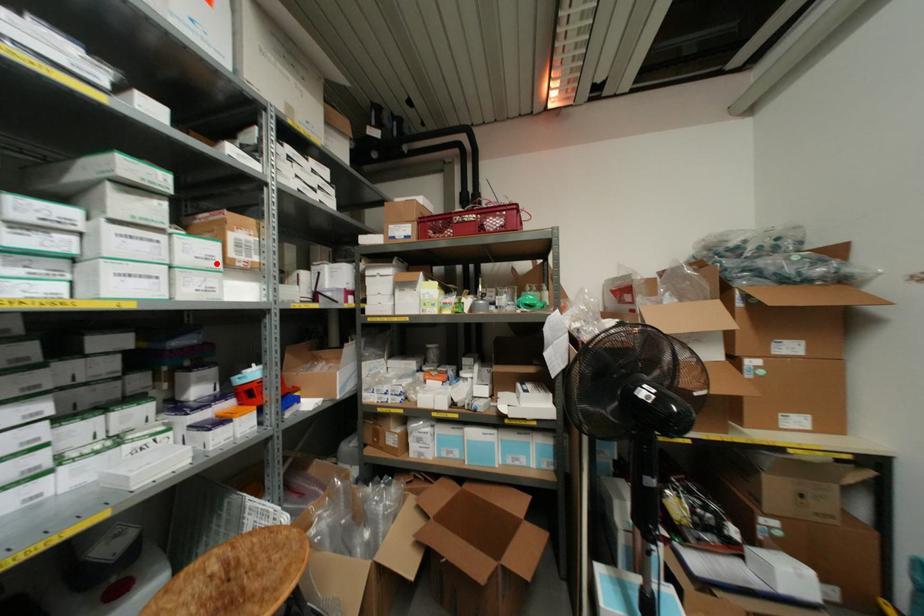
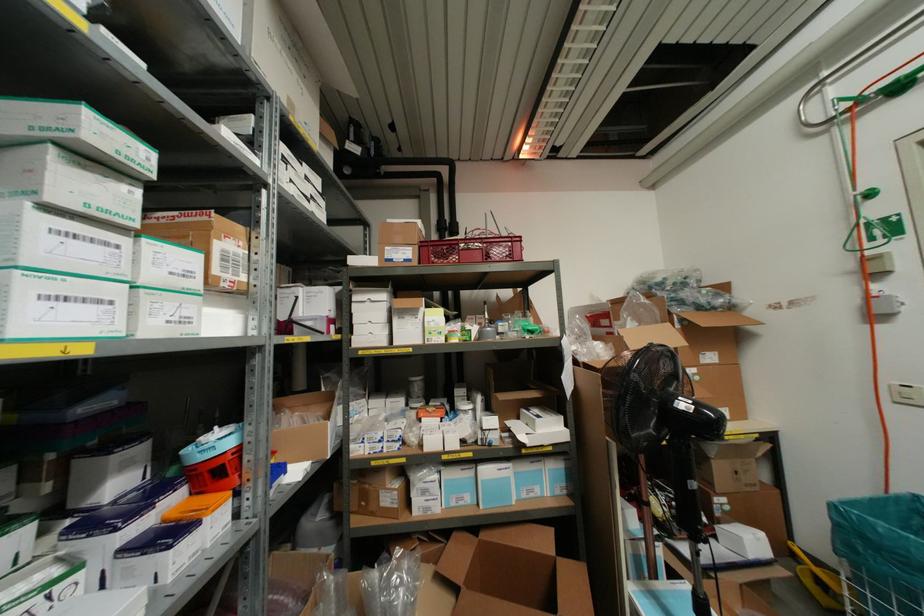
Locate, in the second image, the point that corresponds to the highlighted location in the first image.

(196, 283)